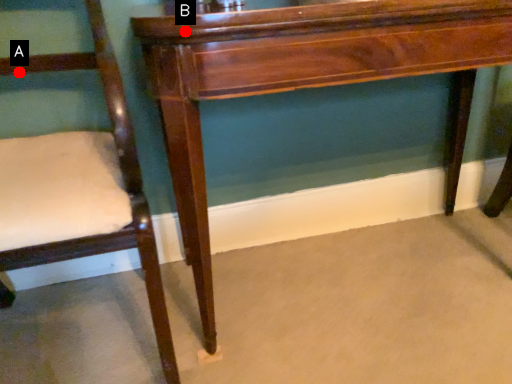
Question: Two points are circled on the image, labeled by A and B beside each circle. Among these points, which one is nearest to the camera?

Choices:
 (A) A is closer
 (B) B is closer

Answer: (B)